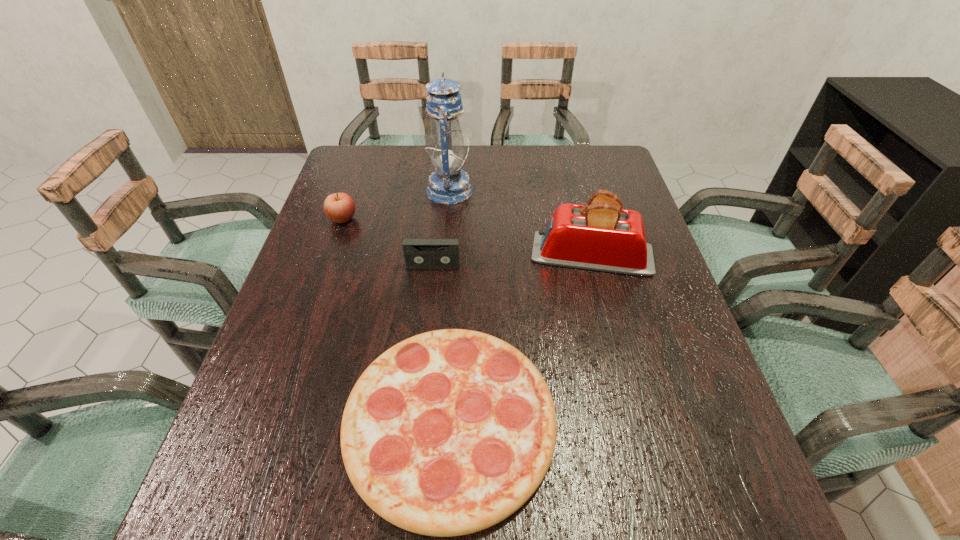
In order to click on free space located on the front of the apple in this screenshot , I will do `click(314, 303)`.

The image size is (960, 540). I want to click on vacant space located 0.050m on the front-facing side of the videotape, so click(431, 284).

Locate an element on the screen. vacant space located 0.100m on the back of the nearest object is located at coordinates (456, 301).

At what (x,y) coordinates should I click in order to perform the action: click on object that is positioned at the far edge. Please return your answer as a coordinate pair (x, y). Looking at the image, I should click on (448, 185).

Identify the location of object at the near edge. (449, 432).

Where is `object located in the left edge section of the desktop`? object located in the left edge section of the desktop is located at coordinates (339, 207).

Where is `object that is at the right edge`? The image size is (960, 540). object that is at the right edge is located at coordinates (601, 236).

What are the coordinates of `free space at the far edge of the desktop` in the screenshot? It's located at (494, 152).

Find the location of a particular element. The image size is (960, 540). free space at the left edge of the desktop is located at coordinates (276, 355).

Identify the location of vacant space at the right edge of the desktop. (624, 187).